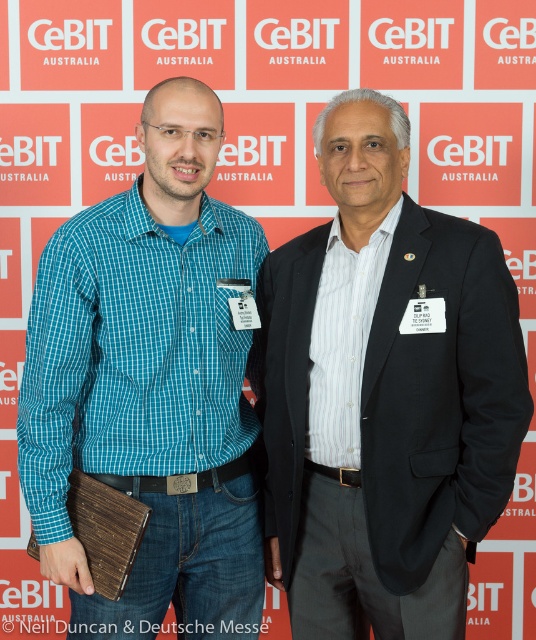
Question: Is dark gray suit at center to the left of teal checkered shirt at center from the viewer's perspective?

Choices:
 (A) no
 (B) yes

Answer: (A)

Question: Which of the following is the closest to the observer?

Choices:
 (A) pos(250,570)
 (B) pos(285,307)

Answer: (B)

Question: Can you confirm if dark gray suit at center is positioned below teal checkered shirt at center?

Choices:
 (A) no
 (B) yes

Answer: (B)

Question: Observing the image, what is the correct spatial positioning of dark gray suit at center in reference to teal checkered shirt at center?

Choices:
 (A) right
 (B) left

Answer: (A)

Question: Which object is farther from the camera taking this photo?

Choices:
 (A) teal checkered shirt at center
 (B) dark gray suit at center

Answer: (A)